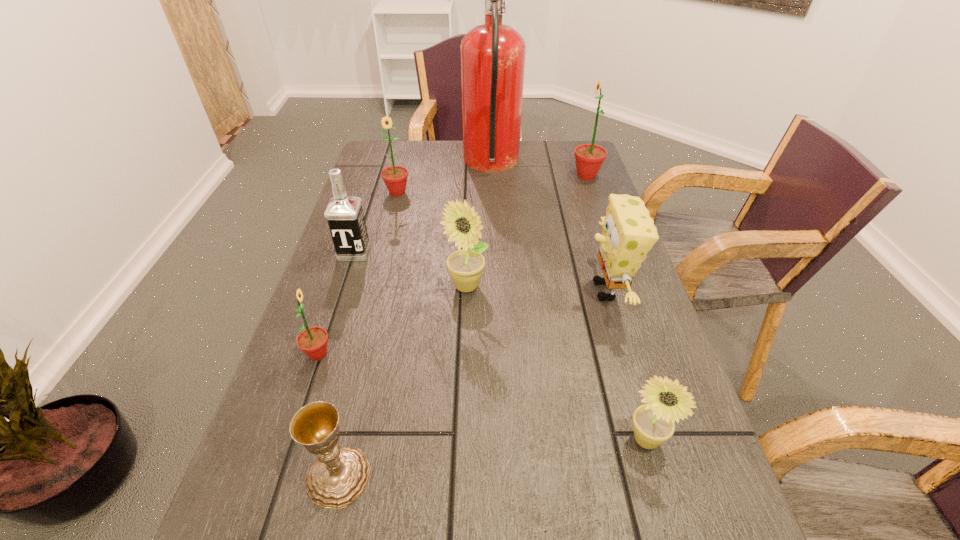
You are a GUI agent. You are given a task and a screenshot of the screen. Output one action in this format:
    pyautogui.click(x=<x>, y=<y>)
    Task: Click on the tallest object
    This screenshot has width=960, height=540.
    Given the screenshot: What is the action you would take?
    pyautogui.click(x=492, y=55)

I want to click on fire extinguisher, so click(x=492, y=55).

Where is `the farthest sunflower`? The image size is (960, 540). the farthest sunflower is located at coordinates (589, 157).

The image size is (960, 540). I want to click on the rightmost green sunflower, so click(589, 157).

Identify the location of the second farthest green sunflower. This screenshot has height=540, width=960. (395, 177).

Identify the location of the second green sunflower from right to left. The image size is (960, 540). (395, 177).

The height and width of the screenshot is (540, 960). I want to click on the third farthest sunflower, so click(462, 224).

What are the coordinates of `the farther yellow sunflower` in the screenshot? It's located at (462, 224).

Where is `vodka`? The height and width of the screenshot is (540, 960). vodka is located at coordinates (344, 214).

Where is `yellow sponge`? yellow sponge is located at coordinates (628, 232).